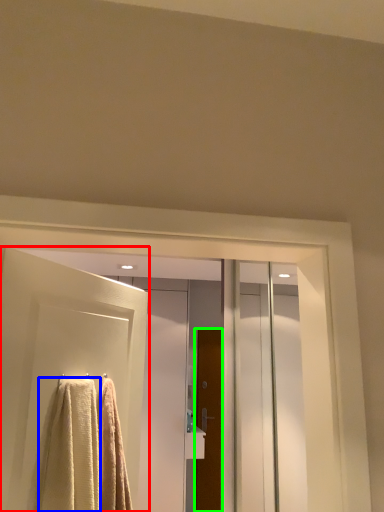
Question: Estimate the real-world distances between objects in this image. Which object is closer to door (highlighted by a red box), towel (highlighted by a blue box) or door (highlighted by a green box)?

Choices:
 (A) towel
 (B) door

Answer: (A)